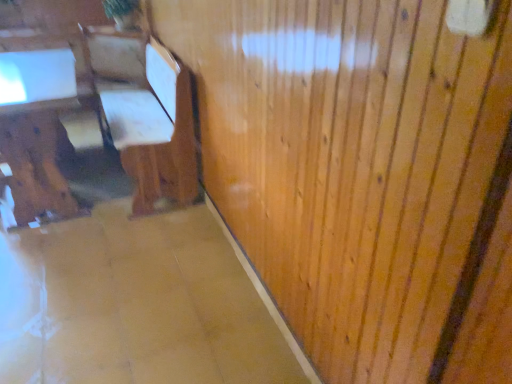
Question: Would you say wooden chair at left is to the left or to the right of matte brown table at left in the picture?

Choices:
 (A) right
 (B) left

Answer: (A)

Question: Looking at their shapes, would you say wooden chair at left is wider or thinner than matte brown table at left?

Choices:
 (A) wide
 (B) thin

Answer: (A)

Question: Is wooden chair at left taller or shorter than matte brown table at left?

Choices:
 (A) short
 (B) tall

Answer: (B)

Question: Considering the positions of point (27, 170) and point (12, 145), is point (27, 170) closer or farther from the camera than point (12, 145)?

Choices:
 (A) closer
 (B) farther

Answer: (B)

Question: In the image, is matte brown table at left on the left side or the right side of wooden chair at left?

Choices:
 (A) right
 (B) left

Answer: (B)

Question: In terms of size, does matte brown table at left appear bigger or smaller than wooden chair at left?

Choices:
 (A) small
 (B) big

Answer: (A)

Question: Is matte brown table at left taller or shorter than wooden chair at left?

Choices:
 (A) short
 (B) tall

Answer: (A)